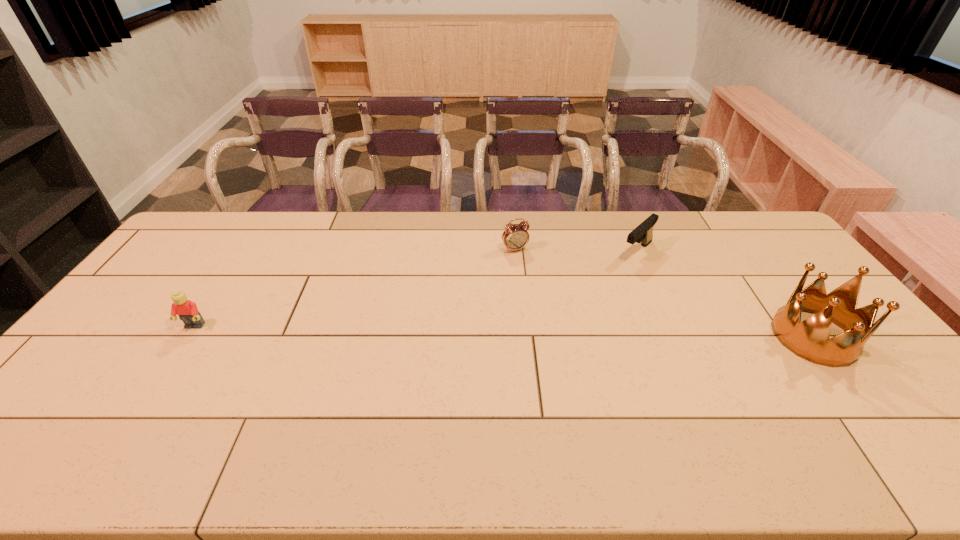
Identify the location of free space on the desktop that is between the Lego and the crown and is positioned on the face of the alarm clock. (568, 333).

Where is `vacant space on the desktop that is between the Lego and the rightmost object and is positioned on the front-facing side of the third object from left to right`? vacant space on the desktop that is between the Lego and the rightmost object and is positioned on the front-facing side of the third object from left to right is located at coordinates (550, 332).